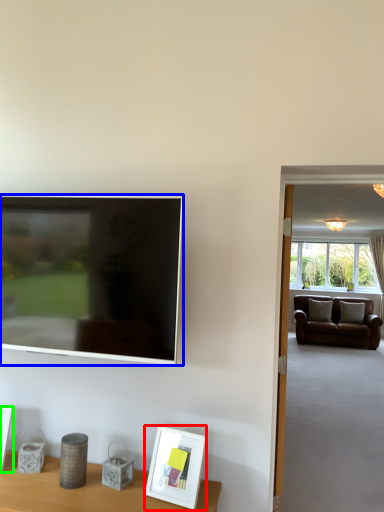
Question: Which object is the farthest from picture frame (highlighted by a red box)? Choose among these: television (highlighted by a blue box) or picture frame (highlighted by a green box).

Choices:
 (A) television
 (B) picture frame

Answer: (B)